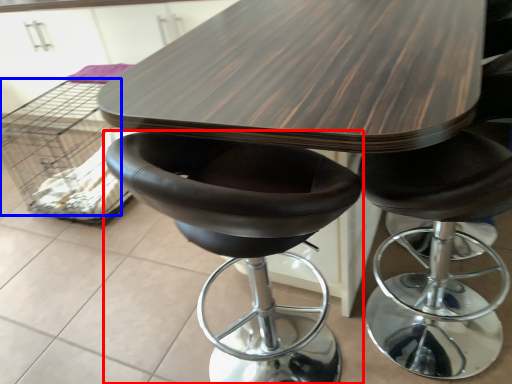
Question: Which object is closer to the camera taking this photo, chair (highlighted by a red box) or crate (highlighted by a blue box)?

Choices:
 (A) chair
 (B) crate

Answer: (A)